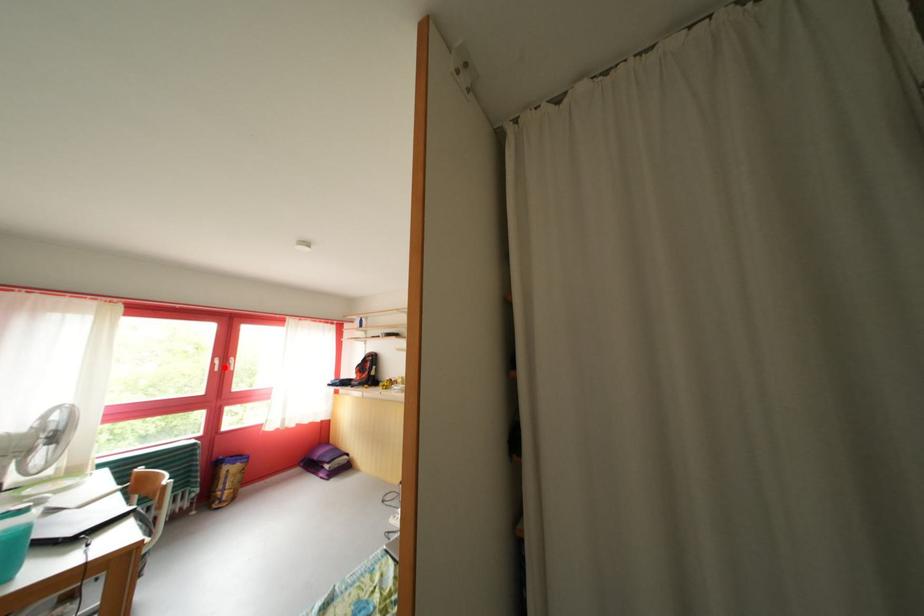
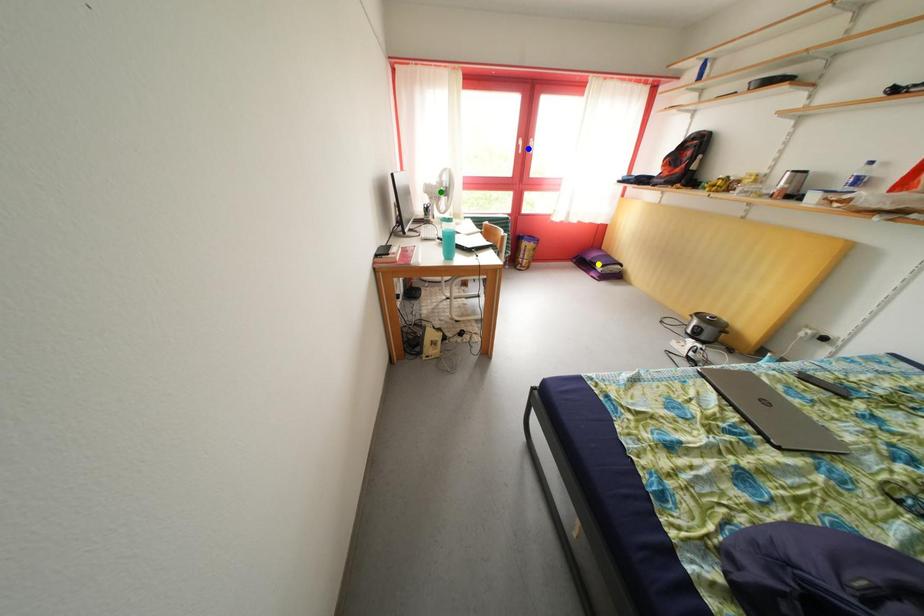
Question: I am providing you with two images of the same scene from different viewpoints. A red point is marked on the first image. You are given multiple points on the second image. Which point in image 2 is actually the same real-world point as the red point in image 1?

Choices:
 (A) yellow point
 (B) blue point
 (C) green point

Answer: (B)